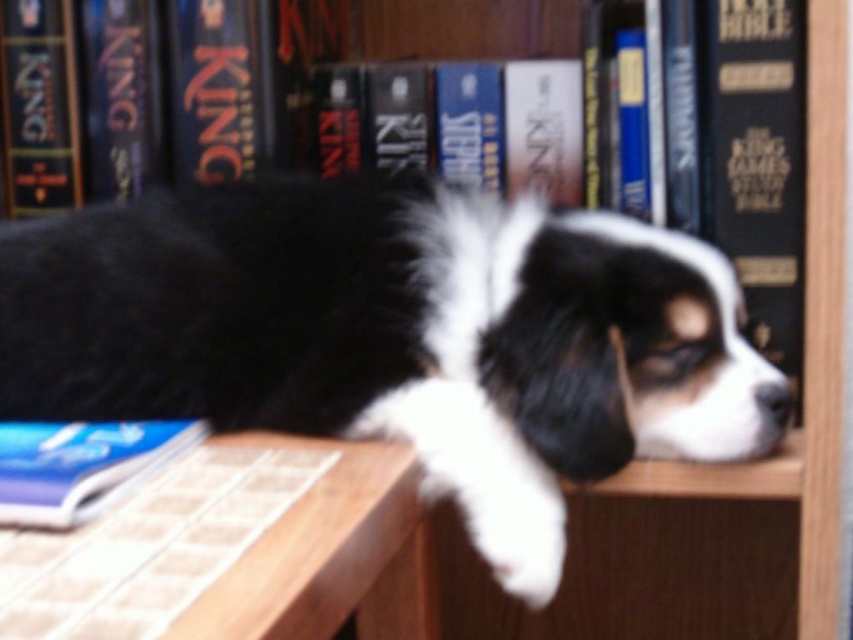
You are a photographer standing in front of a wooden bookshelf. You want to take a photo of the black and white fur at center. If your camera can focus on objects within 50 centimeters, will you need to adjust your position to capture the subject clearly?

The black and white fur at center is 51.68 centimeters away from the viewer. Since the camera can only focus within 50 centimeters, you need to move closer to ensure the subject is in focus.

Based on the photo, you are a small toy that is 10 inches long. You want to move from the wooden table at lower left to the hardcover book at upper right. Can you fit in the space between them without bending?

The distance between the wooden table at lower left and the hardcover book at upper right is 15.22 inches, which is greater than your 10 inch length. Therefore, you can fit in the space between them without bending.

You have a small toy that is 10 cm in length. You want to place it on the wooden table at lower left or the blue paperback book at lower left. Which surface can fit the toy better?

The wooden table at lower left is bigger than the blue paperback book at lower left, so the wooden table at lower left can fit the toy better.